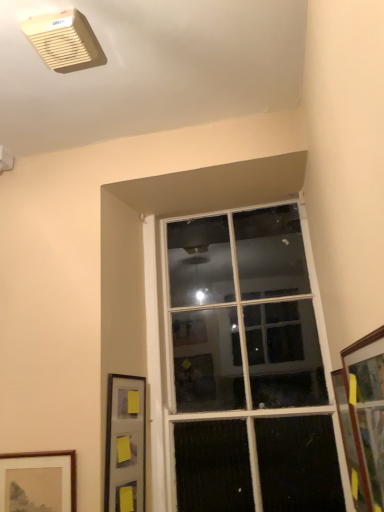
Question: From a real-world perspective, is matte gray picture frame at lower left, the 1th picture frame viewed from the back, positioned under wooden framed picture at lower left, acting as the first picture frame starting from the left, based on gravity?

Choices:
 (A) yes
 (B) no

Answer: (B)

Question: Is matte gray picture frame at lower left, which appears as the third picture frame when viewed from the front, at the left side of wooden framed picture at lower left, which is counted as the 2th picture frame, starting from the back?

Choices:
 (A) yes
 (B) no

Answer: (B)

Question: Is matte gray picture frame at lower left, the second picture frame positioned from the right, bigger than wooden framed picture at lower left, acting as the first picture frame starting from the left?

Choices:
 (A) no
 (B) yes

Answer: (B)

Question: From the image's perspective, would you say matte gray picture frame at lower left, which appears as the third picture frame when viewed from the front, is positioned over wooden framed picture at lower left, acting as the first picture frame starting from the left?

Choices:
 (A) no
 (B) yes

Answer: (B)

Question: Is wooden framed picture at lower left, which is counted as the 2th picture frame, starting from the back, surrounded by matte gray picture frame at lower left, positioned as the second picture frame in left-to-right order?

Choices:
 (A) yes
 (B) no

Answer: (B)

Question: Considering the relative positions of matte gray picture frame at lower left, the second picture frame positioned from the right, and wooden framed picture at lower left, which is counted as the 2th picture frame, starting from the back, in the image provided, is matte gray picture frame at lower left, the second picture frame positioned from the right, behind wooden framed picture at lower left, which is counted as the 2th picture frame, starting from the back,?

Choices:
 (A) no
 (B) yes

Answer: (B)

Question: From a real-world perspective, is clear glass window at center under matte gray picture frame at lower left, which appears as the third picture frame when viewed from the front?

Choices:
 (A) yes
 (B) no

Answer: (B)

Question: Is clear glass window at center in front of matte gray picture frame at lower left, the second picture frame positioned from the right?

Choices:
 (A) no
 (B) yes

Answer: (A)

Question: Are clear glass window at center and matte gray picture frame at lower left, which appears as the third picture frame when viewed from the front, far apart?

Choices:
 (A) yes
 (B) no

Answer: (B)

Question: Is clear glass window at center oriented away from matte gray picture frame at lower left, which appears as the third picture frame when viewed from the front?

Choices:
 (A) yes
 (B) no

Answer: (B)

Question: Can matte gray picture frame at lower left, which appears as the third picture frame when viewed from the front, be found inside clear glass window at center?

Choices:
 (A) no
 (B) yes

Answer: (A)

Question: Considering the relative sizes of clear glass window at center and matte gray picture frame at lower left, the 1th picture frame viewed from the back, in the image provided, is clear glass window at center thinner than matte gray picture frame at lower left, the 1th picture frame viewed from the back,?

Choices:
 (A) no
 (B) yes

Answer: (A)

Question: Is wooden framed picture at lower left, acting as the first picture frame starting from the left, looking in the opposite direction of clear glass window at center?

Choices:
 (A) no
 (B) yes

Answer: (A)